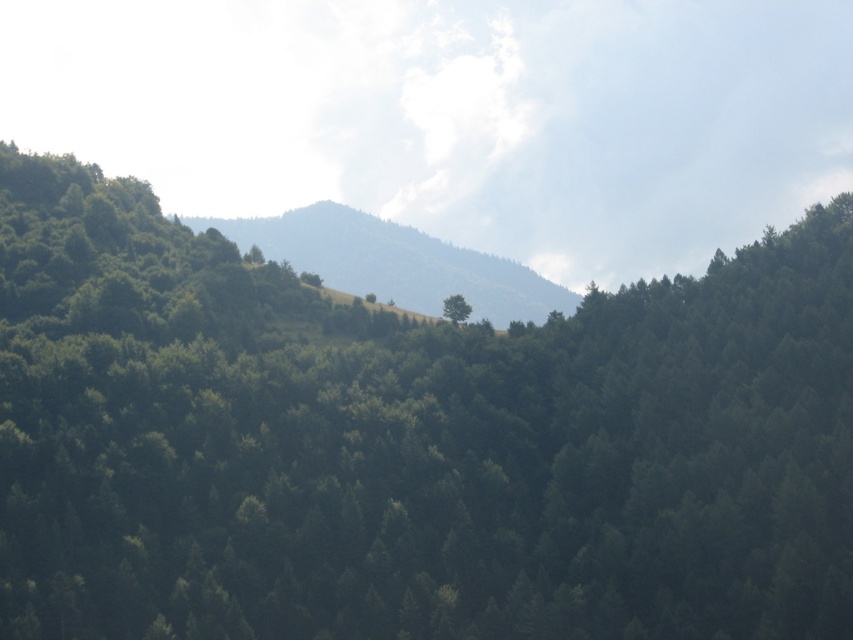
Question: Which of the following is the farthest from the observer?

Choices:
 (A) (485, 268)
 (B) (450, 298)

Answer: (A)

Question: Which of the following is the farthest from the observer?

Choices:
 (A) green grassy hillside at center
 (B) green matte tree at center

Answer: (B)

Question: Observing the image, what is the correct spatial positioning of green grassy hillside at center in reference to green matte tree at center?

Choices:
 (A) above
 (B) below

Answer: (A)

Question: Which point is farther from the camera taking this photo?

Choices:
 (A) click(456, 308)
 (B) click(354, 227)

Answer: (B)

Question: Is green grassy hillside at center positioned before green matte tree at center?

Choices:
 (A) no
 (B) yes

Answer: (B)

Question: Can you confirm if green grassy hillside at center is positioned below green matte tree at center?

Choices:
 (A) yes
 (B) no

Answer: (B)